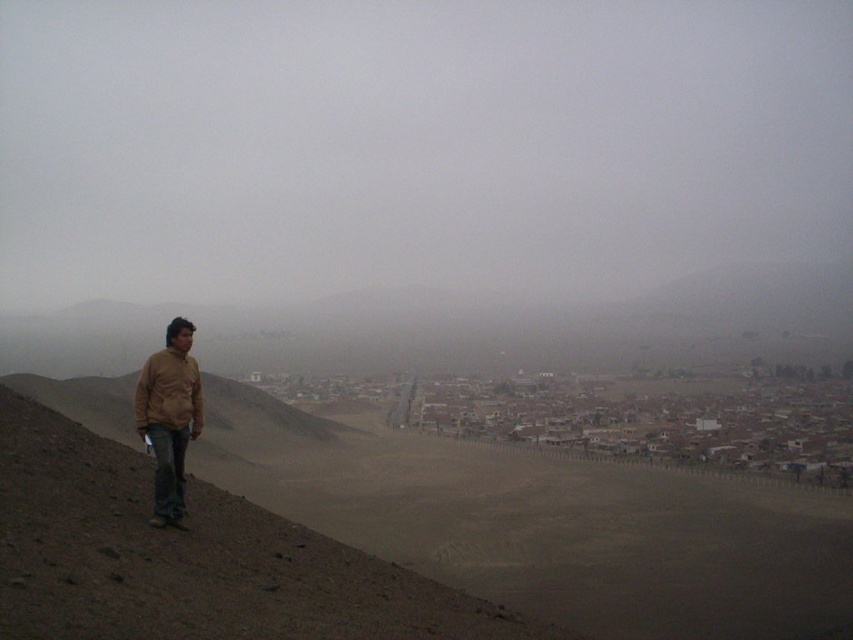
Question: Is gray fog at upper center to the right of dull brown dirt at left from the viewer's perspective?

Choices:
 (A) yes
 (B) no

Answer: (B)

Question: Which object is positioned closest to the matte brown jacket at left?

Choices:
 (A) dull brown dirt at left
 (B) brown matte jacket at lower left

Answer: (B)

Question: Can you confirm if gray fog at upper center is thinner than matte brown jacket at left?

Choices:
 (A) no
 (B) yes

Answer: (A)

Question: Estimate the real-world distances between objects in this image. Which object is farther from the matte brown jacket at left?

Choices:
 (A) gray fog at upper center
 (B) brown matte jacket at lower left

Answer: (A)

Question: Which of the following is the closest to the observer?

Choices:
 (A) (173, 74)
 (B) (309, 624)
 (C) (186, 424)

Answer: (B)

Question: Is matte brown jacket at left above brown matte jacket at lower left?

Choices:
 (A) no
 (B) yes

Answer: (A)